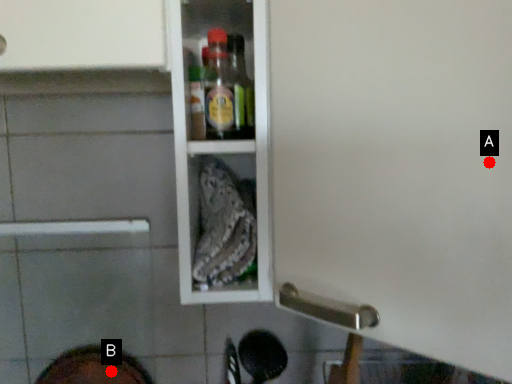
Question: Two points are circled on the image, labeled by A and B beside each circle. Which point is farther to the camera?

Choices:
 (A) A is further
 (B) B is further

Answer: (B)